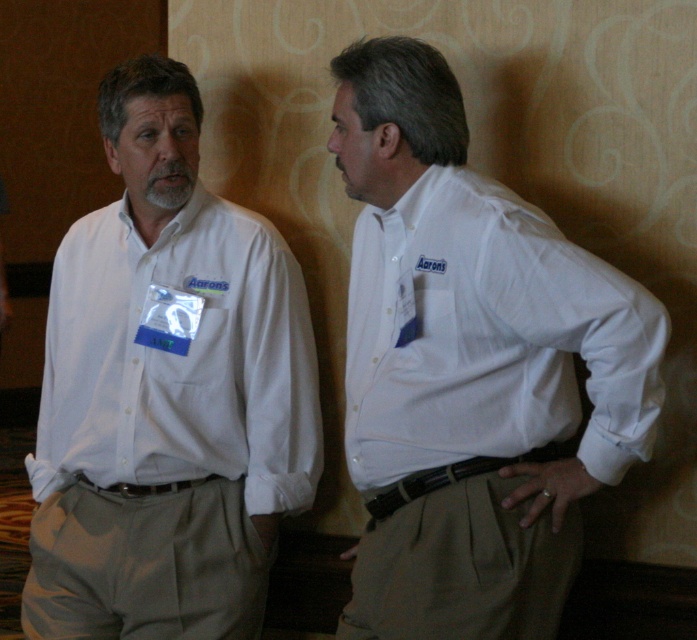
Question: Can you confirm if white cotton shirt at right is positioned to the left of white cotton shirt at left?

Choices:
 (A) yes
 (B) no

Answer: (B)

Question: Can you confirm if white cotton shirt at right is wider than white cotton shirt at left?

Choices:
 (A) no
 (B) yes

Answer: (A)

Question: Which point is farther from the camera taking this photo?

Choices:
 (A) (484, 266)
 (B) (245, 228)

Answer: (B)

Question: Can you confirm if white cotton shirt at right is wider than white cotton shirt at left?

Choices:
 (A) yes
 (B) no

Answer: (B)

Question: Which point is closer to the camera taking this photo?

Choices:
 (A) (275, 298)
 (B) (398, 433)

Answer: (B)